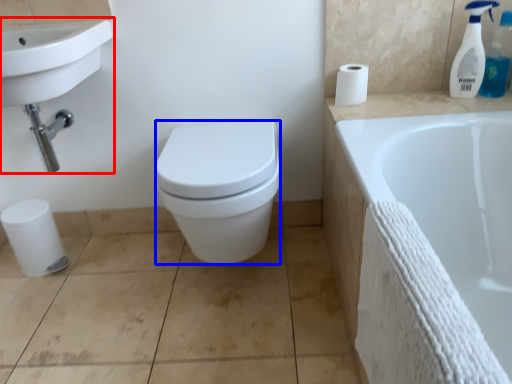
Question: Which object appears closest to the camera in this image, sink (highlighted by a red box) or bidet (highlighted by a blue box)?

Choices:
 (A) sink
 (B) bidet

Answer: (A)